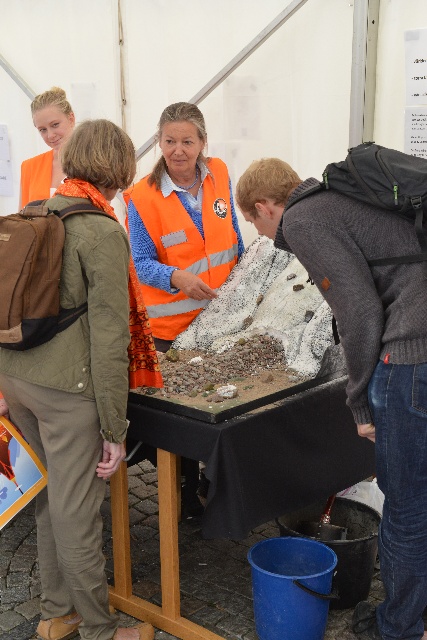
Question: Is black fabric table at center below reflective orange safety vest at center?

Choices:
 (A) yes
 (B) no

Answer: (A)

Question: Can you confirm if orange reflective vest at center is positioned to the left of black fabric table at center?

Choices:
 (A) yes
 (B) no

Answer: (A)

Question: Which point is closer to the camera taking this photo?

Choices:
 (A) (336, 618)
 (B) (167, 209)
 (C) (90, 577)
 (D) (52, 141)

Answer: (C)

Question: Estimate the real-world distances between objects in this image. Which object is closer to the reflective orange safety vest at center?

Choices:
 (A) knitted gray sweater at lower right
 (B) matte orange vest at upper left

Answer: (A)

Question: Is orange reflective vest at center to the right of reflective orange safety vest at center from the viewer's perspective?

Choices:
 (A) yes
 (B) no

Answer: (B)

Question: Which point is closer to the camera?

Choices:
 (A) orange reflective vest at center
 (B) matte orange vest at upper left

Answer: (A)